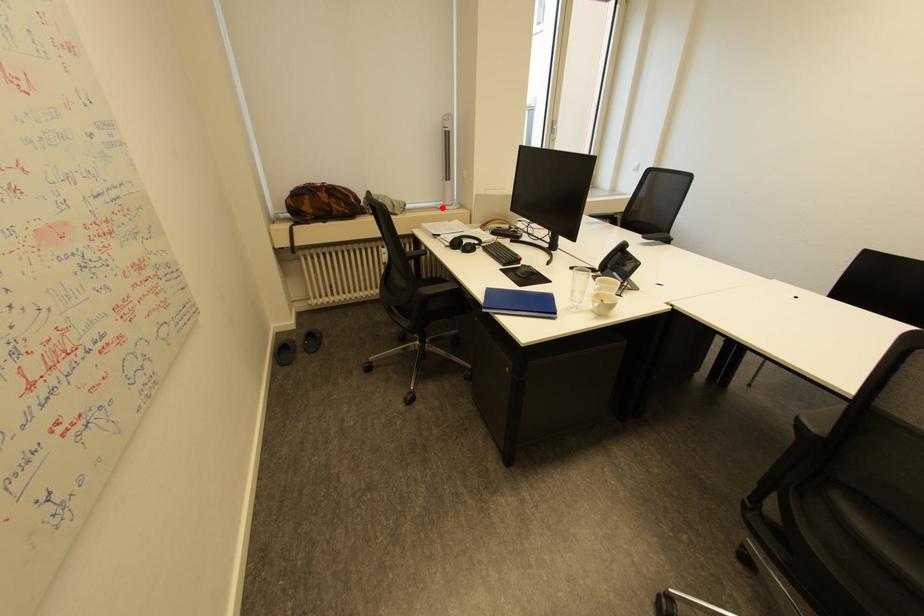
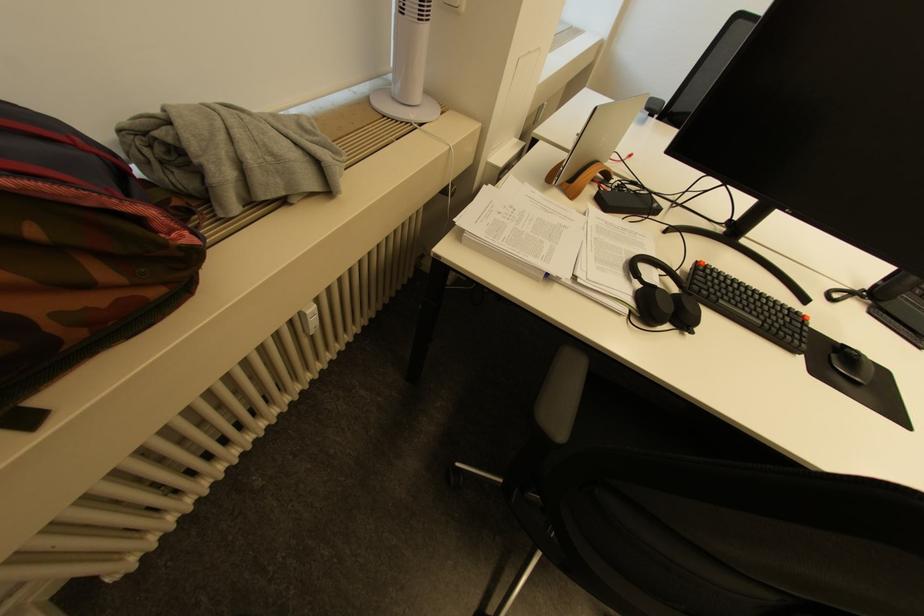
Find the pixel in the second image that matches the highlighted location in the first image.

(391, 116)